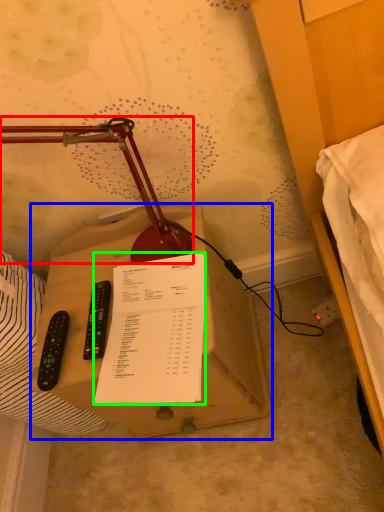
Question: Which object is the farthest from lamp (highlighted by a red box)? Choose among these: table (highlighted by a blue box) or document (highlighted by a green box).

Choices:
 (A) table
 (B) document

Answer: (A)